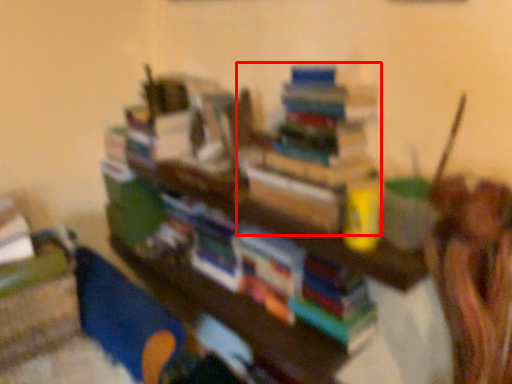
Question: From the image's perspective, what is the correct spatial relationship of book (annotated by the red box) in relation to shelf?

Choices:
 (A) above
 (B) below

Answer: (A)